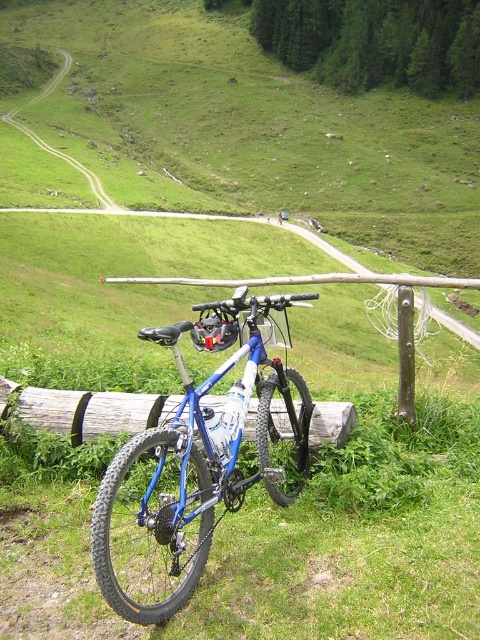
Does blue metallic mountain bike at center have a lesser height compared to wooden log at center?

No.

Is blue metallic mountain bike at center closer to the viewer compared to wooden log at center?

Yes, it is.

Based on the photo, measure the distance between blue metallic mountain bike at center and camera.

blue metallic mountain bike at center is 3.29 meters from camera.

In order to click on blue metallic mountain bike at center in this screenshot , I will do `click(207, 444)`.